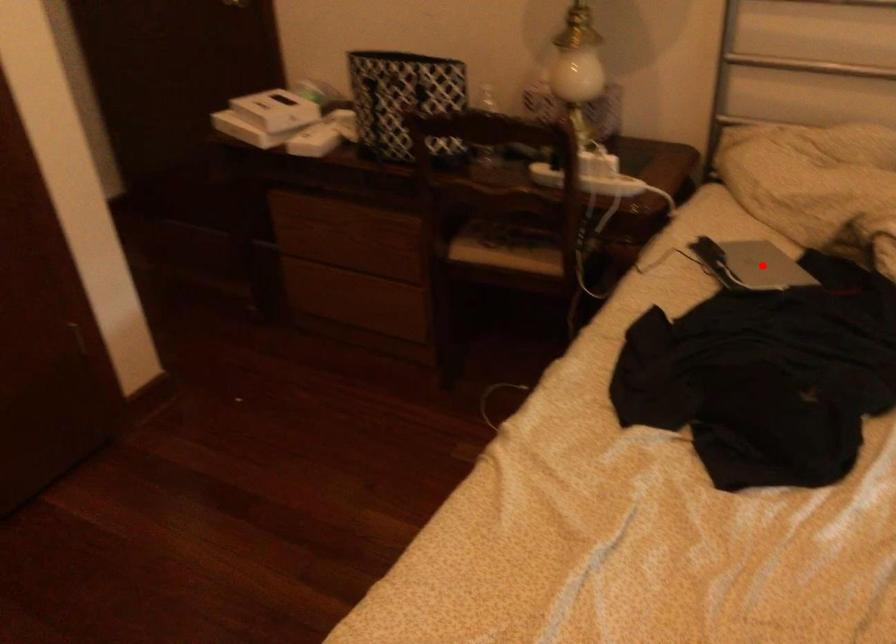
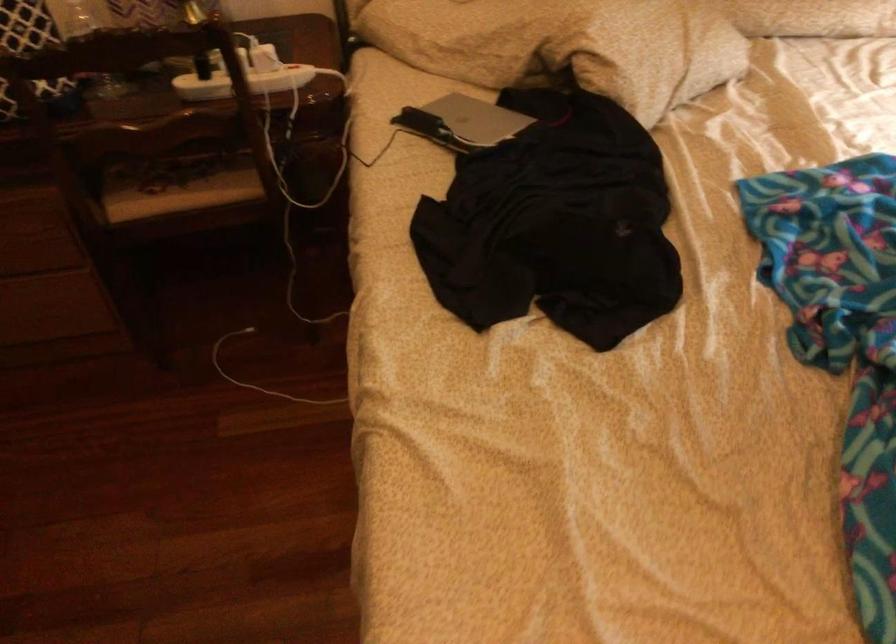
Locate, in the second image, the point that corresponds to the highlighted location in the first image.

(477, 118)